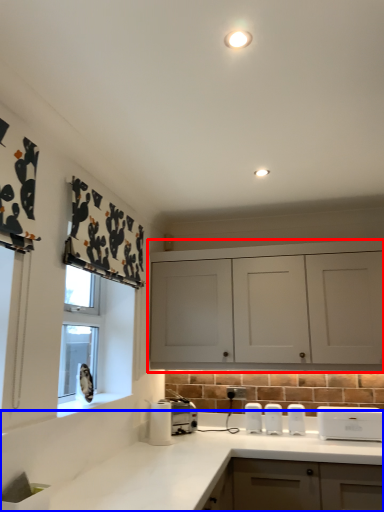
Question: Which object is further to the camera taking this photo, cabinetry (highlighted by a red box) or countertop (highlighted by a blue box)?

Choices:
 (A) cabinetry
 (B) countertop

Answer: (A)